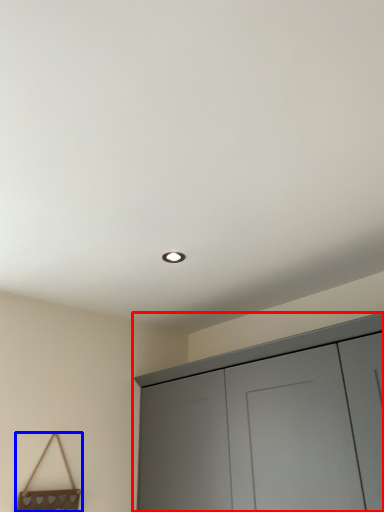
Question: Which object appears farthest to the camera in this image, cupboard (highlighted by a red box) or handbag (highlighted by a blue box)?

Choices:
 (A) cupboard
 (B) handbag

Answer: (B)